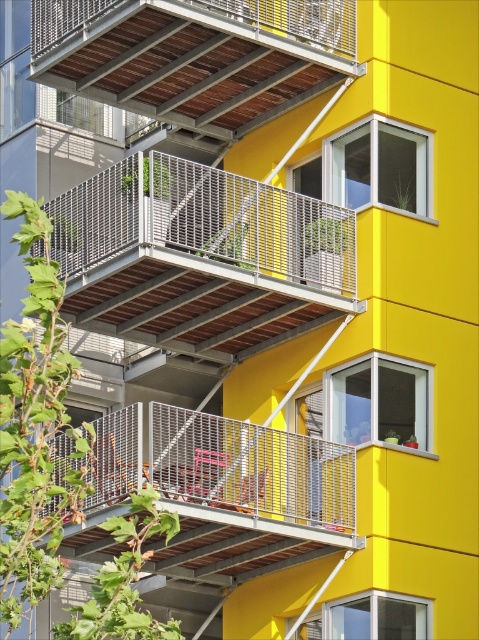
Question: Which object is the closest to the metallic brown balcony at upper center?

Choices:
 (A) metallic gray balcony at upper center
 (B) metallic gray balcony at center

Answer: (A)

Question: Among these objects, which one is nearest to the camera?

Choices:
 (A) metallic gray balcony at upper center
 (B) metallic brown balcony at upper center
 (C) metallic gray balcony at center

Answer: (A)

Question: Estimate the real-world distances between objects in this image. Which object is closer to the metallic gray balcony at center?

Choices:
 (A) metallic gray balcony at upper center
 (B) metallic brown balcony at upper center

Answer: (A)

Question: Does metallic gray balcony at upper center appear under metallic gray balcony at center?

Choices:
 (A) yes
 (B) no

Answer: (B)

Question: Does metallic gray balcony at upper center have a smaller size compared to metallic brown balcony at upper center?

Choices:
 (A) no
 (B) yes

Answer: (A)

Question: Can you confirm if metallic gray balcony at upper center is positioned above metallic gray balcony at center?

Choices:
 (A) no
 (B) yes

Answer: (B)